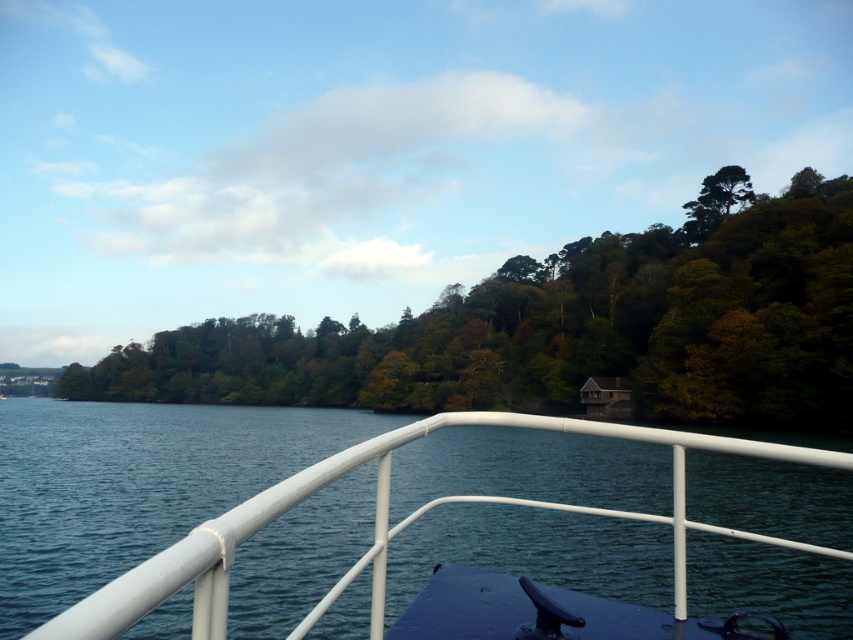
Does white metal boat at center have a larger size compared to green leafy trees at center?

Incorrect, white metal boat at center is not larger than green leafy trees at center.

What do you see at coordinates (134, 484) in the screenshot? The image size is (853, 640). I see `white metal boat at center` at bounding box center [134, 484].

Locate an element on the screen. The height and width of the screenshot is (640, 853). white metal boat at center is located at coordinates (134, 484).